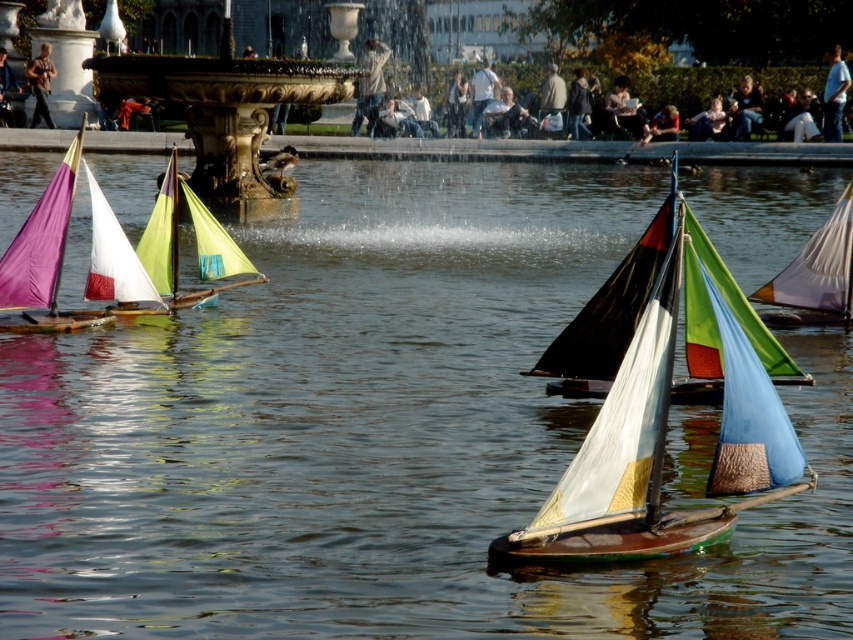
Can you confirm if matte black sailboat at center is positioned above matte purple sailboat at left?

Actually, matte black sailboat at center is below matte purple sailboat at left.

Who is positioned more to the right, matte black sailboat at center or matte purple sailboat at left?

matte black sailboat at center is more to the right.

Locate an element on the screen. The width and height of the screenshot is (853, 640). matte black sailboat at center is located at coordinates (639, 401).

Can you confirm if gold ornate fountain at upper center is taller than matte purple sailboat at left?

In fact, gold ornate fountain at upper center may be shorter than matte purple sailboat at left.

Is point (212, 131) closer to camera compared to point (57, 305)?

No, (212, 131) is further to viewer.

Is point (216, 196) more distant than point (74, 317)?

Yes, point (216, 196) is behind point (74, 317).

This screenshot has height=640, width=853. I want to click on gold ornate fountain at upper center, so click(228, 116).

Does matte black sailboat at center have a lesser height compared to gold ornate fountain at upper center?

Incorrect, matte black sailboat at center's height does not fall short of gold ornate fountain at upper center's.

Looking at this image, is matte black sailboat at center below gold ornate fountain at upper center?

Indeed, matte black sailboat at center is positioned under gold ornate fountain at upper center.

Locate an element on the screen. The image size is (853, 640). matte black sailboat at center is located at coordinates (639, 401).